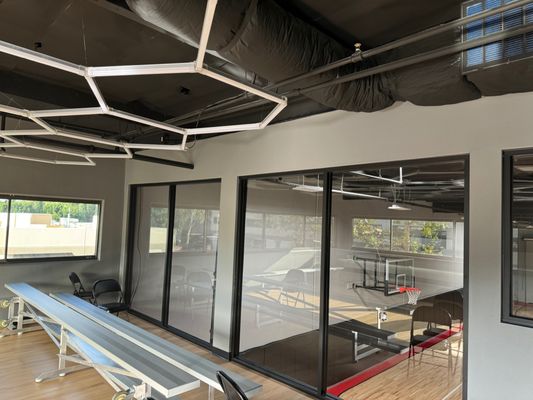
At what (x,y) coordinates should I click in order to perform the action: click on grey ceiling. Please return your answer as a coordinate pair (x, y). Looking at the image, I should click on (129, 48).